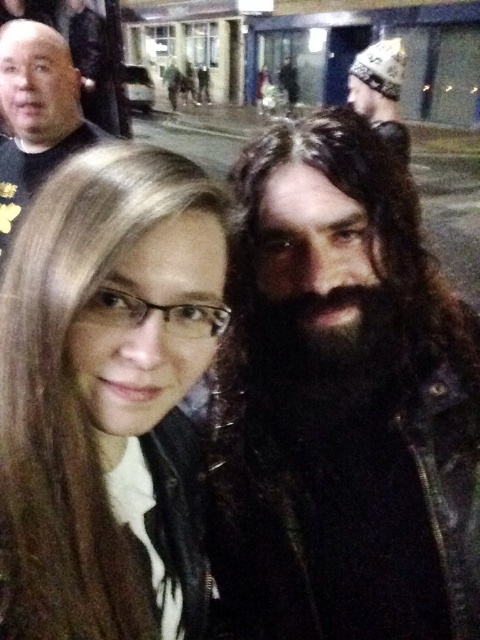
Who is taller, dark brown thick hair at center or black leather jacket at upper left?

black leather jacket at upper left is taller.

Is dark brown thick hair at center shorter than black leather jacket at upper left?

Yes.

The image size is (480, 640). I want to click on dark brown thick hair at center, so click(324, 352).

Does dark brown leather jacket at right have a greater height compared to matte black jacket at center?

Yes, dark brown leather jacket at right is taller than matte black jacket at center.

Measure the distance between dark brown leather jacket at right and camera.

The distance of dark brown leather jacket at right from camera is 61.46 centimeters.

The image size is (480, 640). What are the coordinates of `dark brown leather jacket at right` in the screenshot? It's located at (343, 410).

The width and height of the screenshot is (480, 640). What do you see at coordinates (108, 397) in the screenshot?
I see `matte black jacket at center` at bounding box center [108, 397].

Measure the distance between matte black jacket at center and camera.

matte black jacket at center is 18.29 inches away from camera.

Locate an element on the screen. matte black jacket at center is located at coordinates (108, 397).